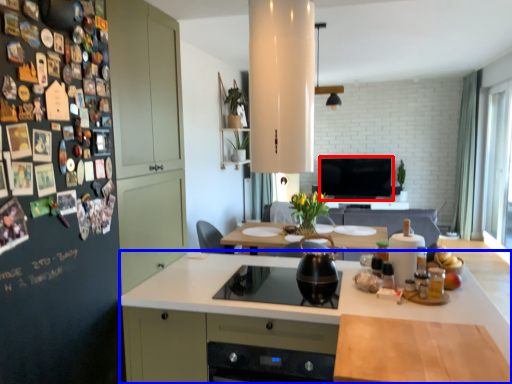
Question: Which of the following is the farthest to the observer, television (highlighted by a red box) or countertop (highlighted by a blue box)?

Choices:
 (A) television
 (B) countertop

Answer: (A)